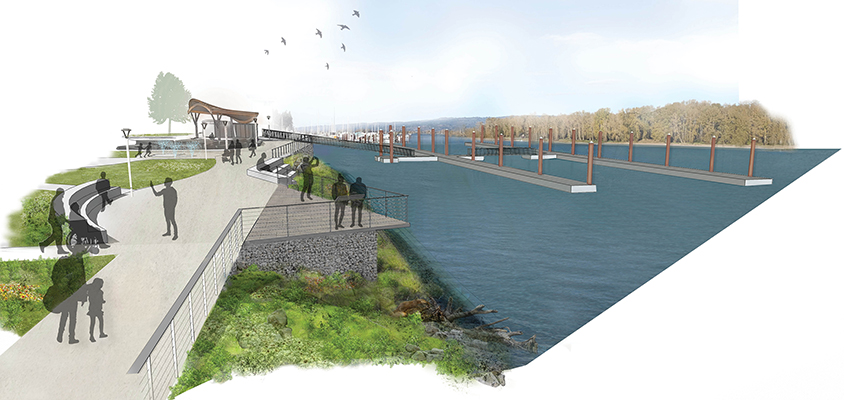
Locate an element on the screen. The width and height of the screenshot is (844, 400). wheel chair is located at coordinates (73, 239).